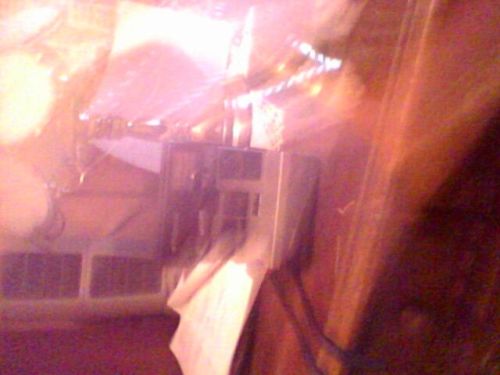
Identify the location of cords. The image size is (500, 375). (326, 347), (309, 361).